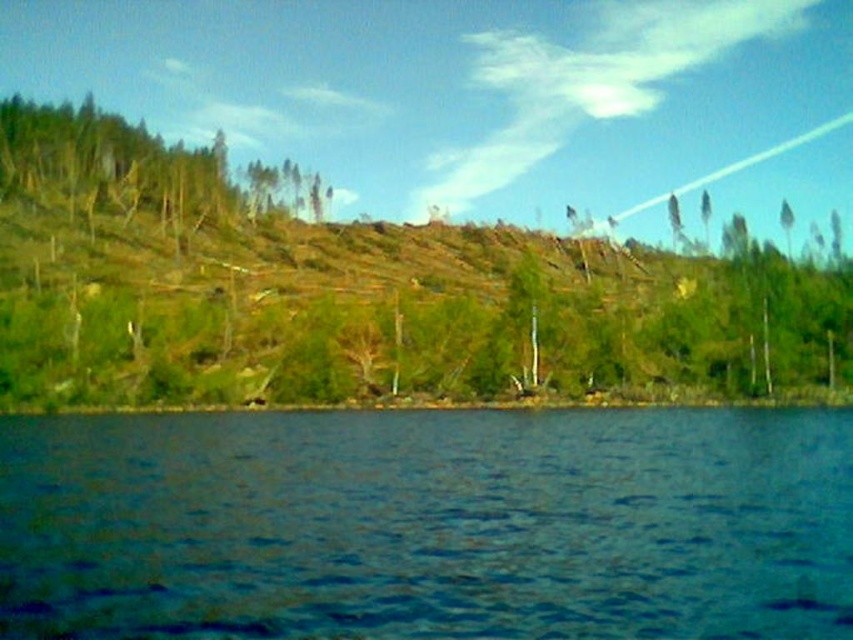
You are an environmental scientist analyzing this landscape. You need to determine the spatial relationship between the blue liquid water at lower center and the green matte tree at upper left. Which object is positioned to the right of the other?

The blue liquid water at lower center is to the right of the green matte tree at upper left, so the blue liquid water at lower center is positioned to the right of the green matte tree at upper left.

You are a hiker standing at the edge of the blue liquid water at lower center. You want to take a photo of the green matte tree at upper left. Which direction should you face to capture the tree in your view?

Since the blue liquid water at lower center is in front of the green matte tree at upper left, you should face towards the upper left direction to capture the green matte tree at upper left in your view.

You are a hiker standing at the edge of the blue liquid water at lower center. You want to reach the green matte tree at upper left. Considering their heights, which direction should you go to ascend?

The blue liquid water at lower center has a lesser height compared to the green matte tree at upper left, so you should ascend towards the green matte tree at upper left as it is higher in elevation.